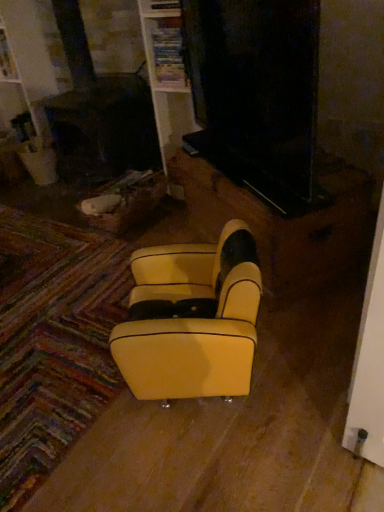
The image size is (384, 512). Describe the element at coordinates (192, 319) in the screenshot. I see `yellow leather/velvet rocking chair at center` at that location.

You are a GUI agent. You are given a task and a screenshot of the screen. Output one action in this format:
    pyautogui.click(x=<x>, y=<y>)
    Task: Click on the yellow leather/velvet rocking chair at center
    
    Given the screenshot: What is the action you would take?
    pyautogui.click(x=192, y=319)

Measure the distance between point (x=214, y=210) and camera.

Point (x=214, y=210) is 6.78 feet away from camera.

Locate an element on the screen. Image resolution: width=384 pixels, height=512 pixels. yellow leather armchair at center is located at coordinates (287, 225).

What do you see at coordinates (287, 225) in the screenshot? I see `yellow leather armchair at center` at bounding box center [287, 225].

At what (x,y) coordinates should I click in order to perform the action: click on yellow leather/velvet rocking chair at center. Please return your answer as a coordinate pair (x, y). The width and height of the screenshot is (384, 512). Looking at the image, I should click on (192, 319).

Between yellow leather armchair at center and yellow leather/velvet rocking chair at center, which one appears on the left side from the viewer's perspective?

yellow leather/velvet rocking chair at center.

Which object is further away from the camera, yellow leather armchair at center or yellow leather/velvet rocking chair at center?

yellow leather armchair at center is further from the camera.

Considering the positions of points (270, 225) and (260, 284), is point (270, 225) farther from camera compared to point (260, 284)?

Yes.

From the image's perspective, would you say yellow leather armchair at center is shown under yellow leather/velvet rocking chair at center?

Actually, yellow leather armchair at center appears above yellow leather/velvet rocking chair at center in the image.

From a real-world perspective, which object stands above the other?

yellow leather/velvet rocking chair at center.

Can you confirm if yellow leather armchair at center is thinner than yellow leather/velvet rocking chair at center?

No, yellow leather armchair at center is not thinner than yellow leather/velvet rocking chair at center.

Considering the relative sizes of yellow leather armchair at center and yellow leather/velvet rocking chair at center in the image provided, is yellow leather armchair at center taller than yellow leather/velvet rocking chair at center?

No.

Is yellow leather armchair at center smaller than yellow leather/velvet rocking chair at center?

Incorrect, yellow leather armchair at center is not smaller in size than yellow leather/velvet rocking chair at center.

Do you think yellow leather armchair at center is within yellow leather/velvet rocking chair at center, or outside of it?

yellow leather armchair at center is spatially situated outside yellow leather/velvet rocking chair at center.

Is yellow leather armchair at center not close to yellow leather/velvet rocking chair at center?

No, there isn't a large distance between yellow leather armchair at center and yellow leather/velvet rocking chair at center.

Consider the image. Is yellow leather armchair at center turned away from yellow leather/velvet rocking chair at center?

No, yellow leather armchair at center is not facing away from yellow leather/velvet rocking chair at center.

What's the angular difference between yellow leather armchair at center and yellow leather/velvet rocking chair at center's facing directions?

yellow leather armchair at center and yellow leather/velvet rocking chair at center are facing 25.9 degrees away from each other.

How much distance is there between yellow leather armchair at center and yellow leather/velvet rocking chair at center?

yellow leather armchair at center and yellow leather/velvet rocking chair at center are 17.19 inches apart.

The image size is (384, 512). I want to click on furniture behind the yellow leather/velvet rocking chair at center, so click(x=287, y=225).

Can you confirm if yellow leather/velvet rocking chair at center is positioned to the right of yellow leather armchair at center?

No, yellow leather/velvet rocking chair at center is not to the right of yellow leather armchair at center.

Does yellow leather/velvet rocking chair at center lie behind yellow leather armchair at center?

No, it is not.

Is point (201, 331) less distant than point (296, 290)?

Yes, point (201, 331) is in front of point (296, 290).

From the image's perspective, relative to yellow leather armchair at center, is yellow leather/velvet rocking chair at center above or below?

Based on their image positions, yellow leather/velvet rocking chair at center is located beneath yellow leather armchair at center.

From the picture: From a real-world perspective, is yellow leather/velvet rocking chair at center located higher than yellow leather armchair at center?

Yes, from a real-world perspective, yellow leather/velvet rocking chair at center is above yellow leather armchair at center.

Is yellow leather/velvet rocking chair at center thinner than yellow leather armchair at center?

Yes, yellow leather/velvet rocking chair at center is thinner than yellow leather armchair at center.

Is yellow leather/velvet rocking chair at center taller or shorter than yellow leather armchair at center?

In the image, yellow leather/velvet rocking chair at center appears to be taller than yellow leather armchair at center.

Is yellow leather/velvet rocking chair at center bigger than yellow leather armchair at center?

Incorrect, yellow leather/velvet rocking chair at center is not larger than yellow leather armchair at center.

Is yellow leather/velvet rocking chair at center not inside yellow leather armchair at center?

Yes.

Can you see yellow leather/velvet rocking chair at center touching yellow leather armchair at center?

No, yellow leather/velvet rocking chair at center is not making contact with yellow leather armchair at center.

Is yellow leather armchair at center at the back of yellow leather/velvet rocking chair at center?

No, yellow leather/velvet rocking chair at center is not facing the opposite direction of yellow leather armchair at center.

How many degrees apart are the facing directions of yellow leather/velvet rocking chair at center and yellow leather armchair at center?

The facing directions of yellow leather/velvet rocking chair at center and yellow leather armchair at center are 25.9 degrees apart.

How much distance is there between yellow leather/velvet rocking chair at center and yellow leather armchair at center?

They are 17.19 inches apart.

What are the coordinates of `rocking chair lying in front of the yellow leather armchair at center` in the screenshot? It's located at (192, 319).

Locate an element on the screen. This screenshot has height=512, width=384. furniture to the right of yellow leather/velvet rocking chair at center is located at coordinates (287, 225).

Where is `furniture lying above the yellow leather/velvet rocking chair at center (from the image's perspective)`? This screenshot has width=384, height=512. furniture lying above the yellow leather/velvet rocking chair at center (from the image's perspective) is located at coordinates (287, 225).